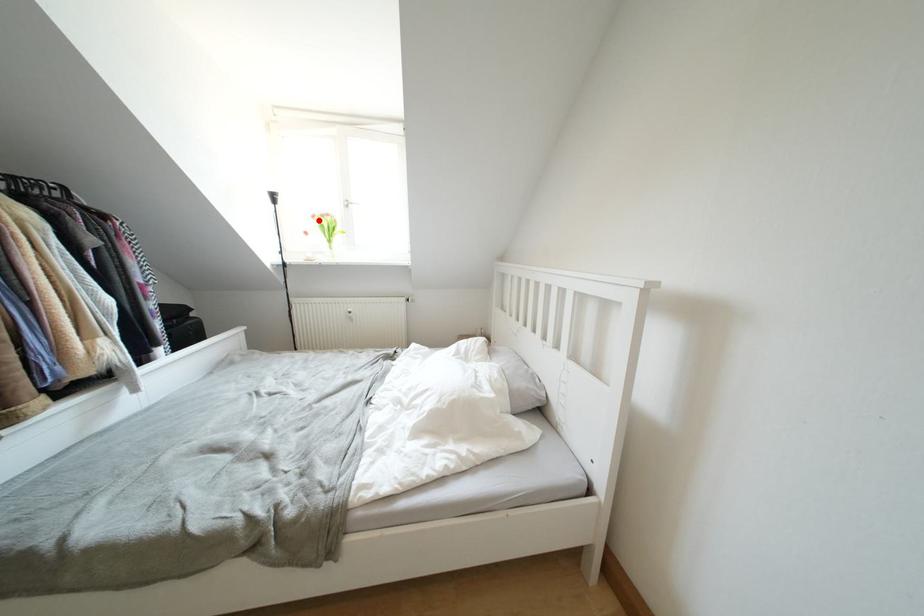
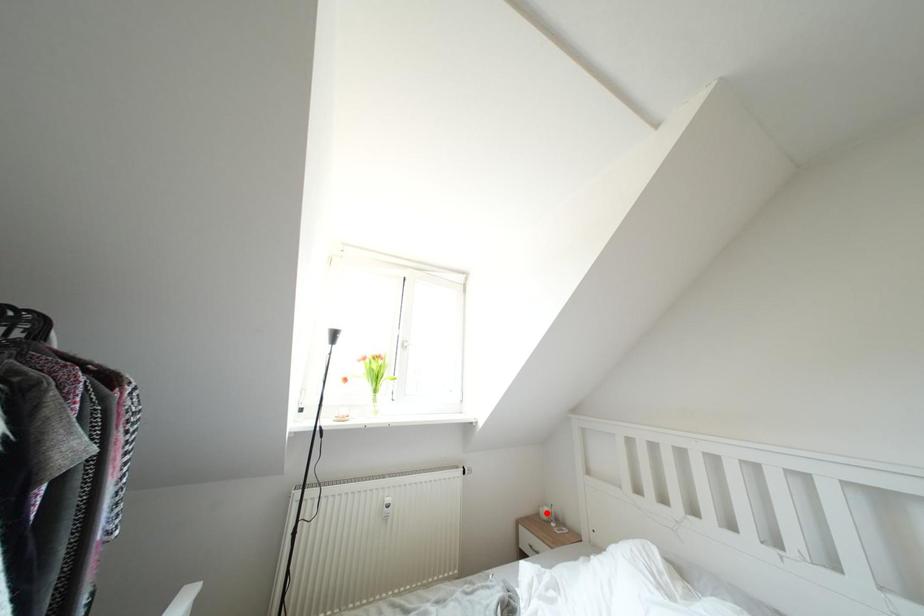
I am providing you with two images of the same scene from different viewpoints. A red point is marked on the first image and another point is marked on the second image. Are the points marked in image1 and image2 representing the same 3D position?

No